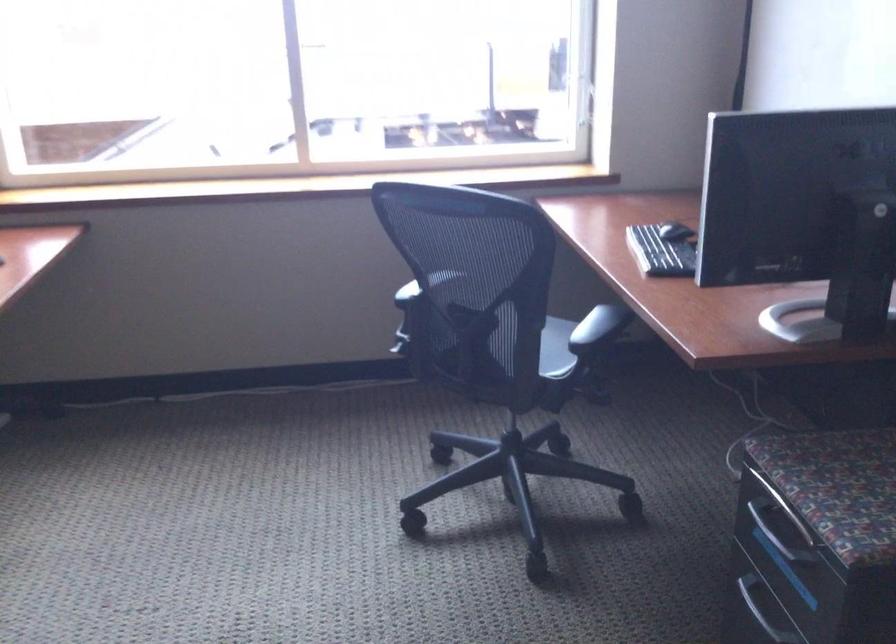
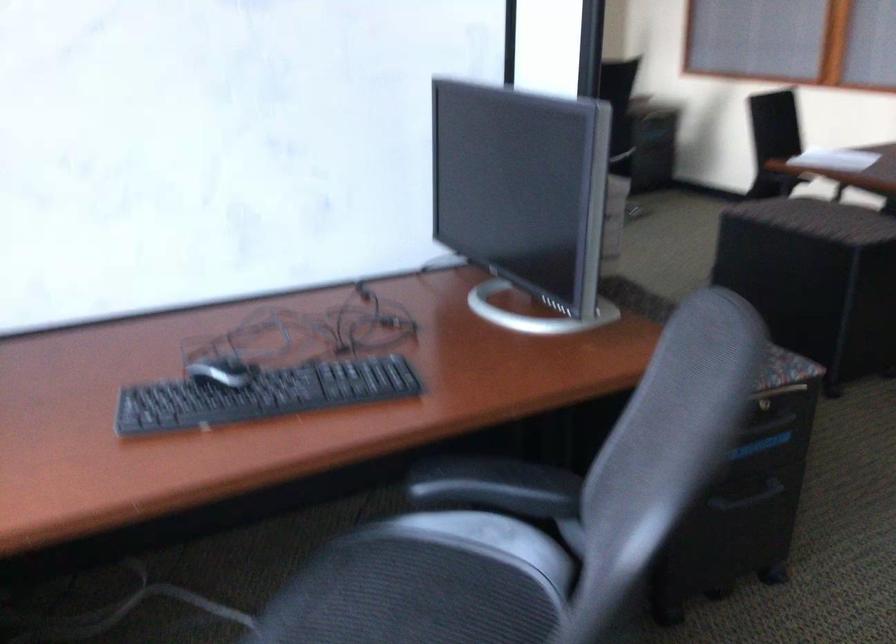
Question: I am providing you with two images of the same scene from different viewpoints. After the viewpoint changes to image2, which objects are now occluded?

Choices:
 (A) cabinet drawer handle
 (B) blue plastic handle
 (C) computer mouse
 (D) chair sitting surface

Answer: (D)